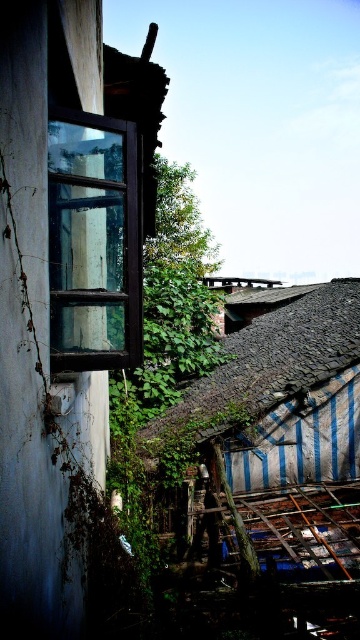
Between dark brown wooden window at left and rusty corrugated metal roof at center, which one appears on the left side from the viewer's perspective?

dark brown wooden window at left

Can you confirm if dark brown wooden window at left is positioned to the right of rusty corrugated metal roof at center?

In fact, dark brown wooden window at left is to the left of rusty corrugated metal roof at center.

What are the coordinates of `dark brown wooden window at left` in the screenshot? It's located at (93, 243).

The height and width of the screenshot is (640, 360). In order to click on dark brown wooden window at left in this screenshot , I will do click(93, 243).

Does wooden window frame at left appear on the left side of dark brown wooden window at left?

Correct, you'll find wooden window frame at left to the left of dark brown wooden window at left.

What do you see at coordinates (64, 284) in the screenshot? Image resolution: width=360 pixels, height=640 pixels. I see `wooden window frame at left` at bounding box center [64, 284].

Measure the distance between wooden window frame at left and camera.

wooden window frame at left is 1.52 meters away from camera.

Where is `wooden window frame at left`? The image size is (360, 640). wooden window frame at left is located at coordinates (64, 284).

Who is positioned more to the right, wooden window frame at left or rusty corrugated metal roof at center?

Positioned to the right is rusty corrugated metal roof at center.

Identify the location of wooden window frame at left. The height and width of the screenshot is (640, 360). (64, 284).